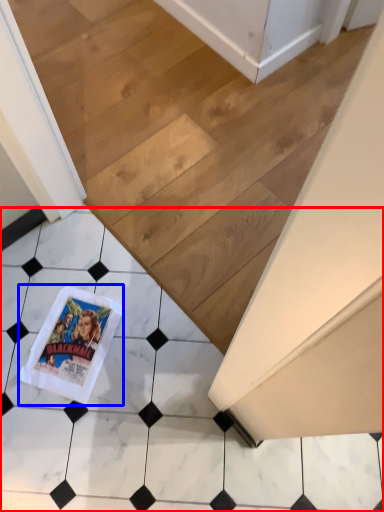
Question: Which object appears farthest to the camera in this image, tile (highlighted by a red box) or comic book (highlighted by a blue box)?

Choices:
 (A) tile
 (B) comic book

Answer: (B)